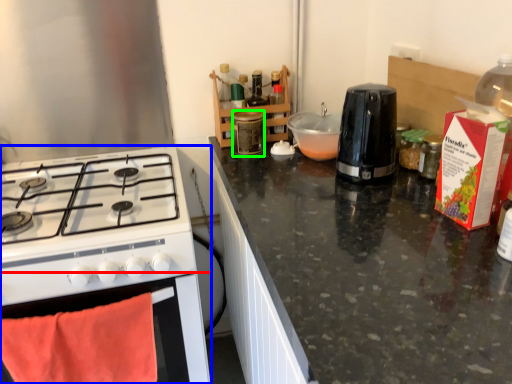
Question: Which is nearer to the oven (highlighted by a red box)? kitchen appliance (highlighted by a blue box) or bottle (highlighted by a green box).

Choices:
 (A) kitchen appliance
 (B) bottle

Answer: (A)